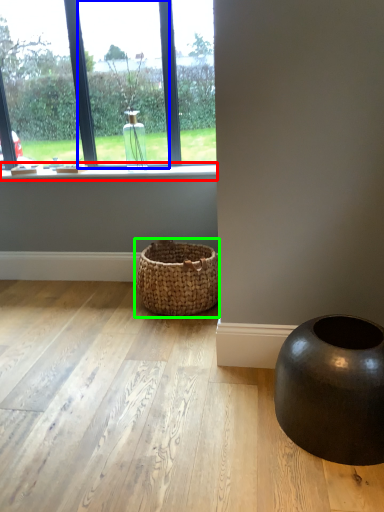
Question: Which is farther away from window sill (highlighted by a red box)? window (highlighted by a blue box) or basket (highlighted by a green box)?

Choices:
 (A) window
 (B) basket

Answer: (B)